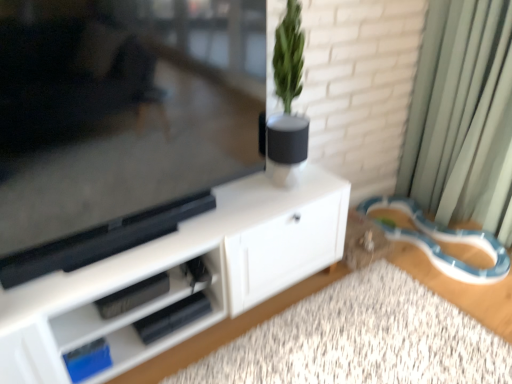
Question: Is blue plastic leash at lower right positioned before white matte vase at center?

Choices:
 (A) no
 (B) yes

Answer: (A)

Question: Does blue plastic leash at lower right appear on the right side of white matte vase at center?

Choices:
 (A) no
 (B) yes

Answer: (B)

Question: Can you confirm if blue plastic leash at lower right is thinner than white matte vase at center?

Choices:
 (A) yes
 (B) no

Answer: (B)

Question: Is blue plastic leash at lower right taller than white matte vase at center?

Choices:
 (A) no
 (B) yes

Answer: (A)

Question: Does blue plastic leash at lower right turn towards white matte vase at center?

Choices:
 (A) no
 (B) yes

Answer: (A)

Question: From a real-world perspective, is blue plastic leash at lower right physically below white matte vase at center?

Choices:
 (A) yes
 (B) no

Answer: (A)

Question: Can we say green matte plant at upper center lies outside white matte vase at center?

Choices:
 (A) yes
 (B) no

Answer: (A)

Question: Considering the relative sizes of green matte plant at upper center and white matte vase at center in the image provided, is green matte plant at upper center bigger than white matte vase at center?

Choices:
 (A) no
 (B) yes

Answer: (B)

Question: From the image's perspective, is green matte plant at upper center on top of white matte vase at center?

Choices:
 (A) yes
 (B) no

Answer: (A)

Question: Does green matte plant at upper center have a greater width compared to white matte vase at center?

Choices:
 (A) yes
 (B) no

Answer: (A)

Question: Is the depth of green matte plant at upper center greater than that of white matte vase at center?

Choices:
 (A) yes
 (B) no

Answer: (B)

Question: Could you tell me if green matte plant at upper center is facing white matte vase at center?

Choices:
 (A) no
 (B) yes

Answer: (A)

Question: From a real-world perspective, is white matte cabinet at center located beneath white matte vase at center?

Choices:
 (A) no
 (B) yes

Answer: (B)